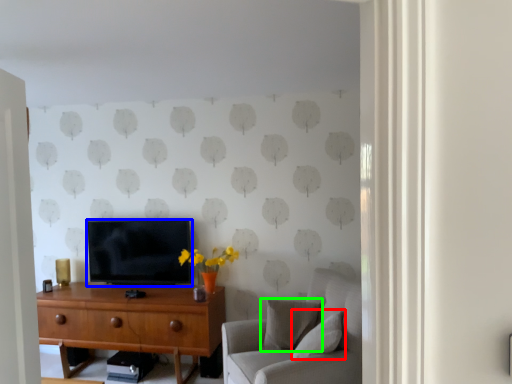
Question: Which object is the closest to the pillow (highlighted by a red box)? Choose among these: television (highlighted by a blue box) or pillow (highlighted by a green box).

Choices:
 (A) television
 (B) pillow

Answer: (B)